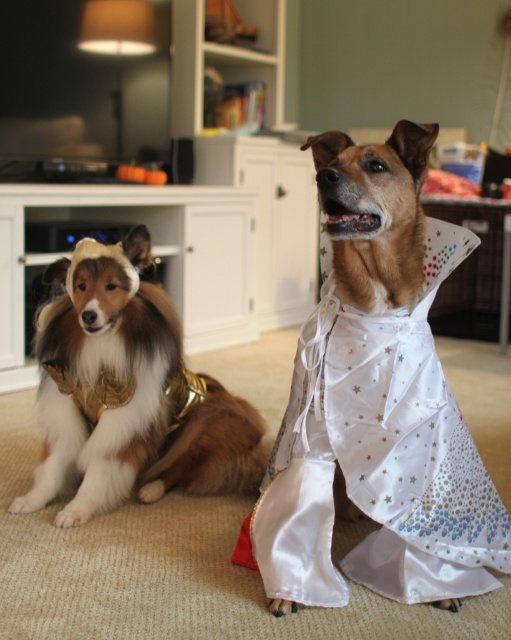
Question: Observing the image, what is the correct spatial positioning of white satin dress at center in reference to golden fur dog at left?

Choices:
 (A) above
 (B) below

Answer: (A)

Question: Can you confirm if white satin dress at center is thinner than golden fur dog at left?

Choices:
 (A) no
 (B) yes

Answer: (B)

Question: Is white satin dress at center further to the viewer compared to golden fur dog at left?

Choices:
 (A) yes
 (B) no

Answer: (B)

Question: Among these points, which one is nearest to the camera?

Choices:
 (A) (58, 515)
 (B) (401, 429)

Answer: (B)